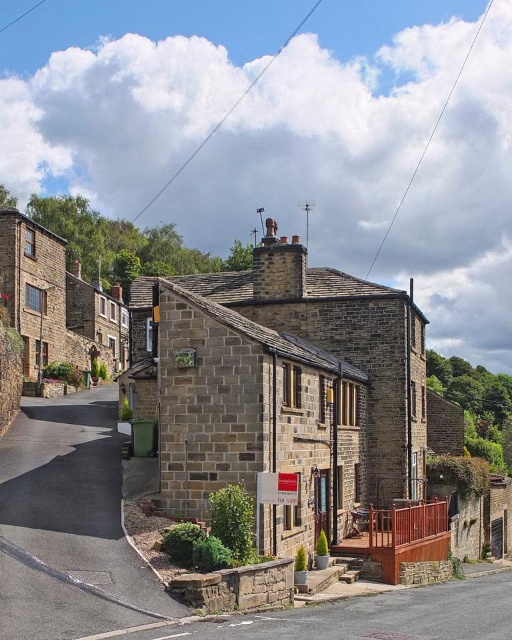
Does brown stone house at center have a greater height compared to asphalt road at lower left?

Indeed, brown stone house at center has a greater height compared to asphalt road at lower left.

Locate an element on the screen. The height and width of the screenshot is (640, 512). brown stone house at center is located at coordinates (284, 390).

What are the coordinates of `brown stone house at center` in the screenshot? It's located at 284,390.